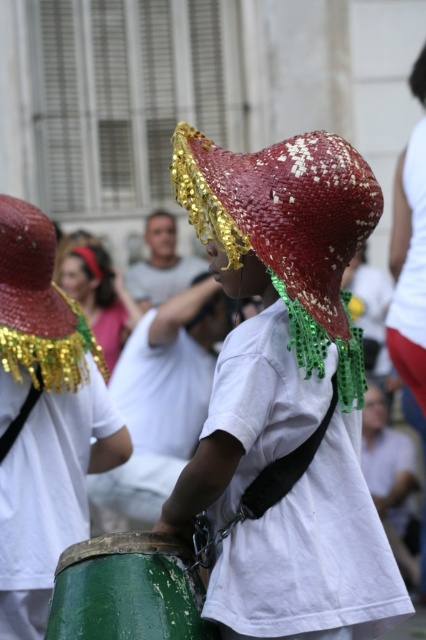
You are a photographer trying to capture the child in the center with their hat and drum. Since the red straw hat at center is taller than the green weathered wood drum at lower center, which object would you need to position closer to the camera to ensure both are fully visible in the frame?

To ensure both the red straw hat at center and the green weathered wood drum at lower center are fully visible in the frame, you should position the green weathered wood drum at lower center closer to the camera since it is shorter than the red straw hat at center.

You are a photographer standing at the center of the street. You want to take a photo that includes both the red woven hat at center and the red straw hat at center. Given that your camera has a maximum focus range of 4 feet, can you capture both objects in focus without moving your position?

The distance between the red woven hat at center and the red straw hat at center is 4.01 feet, which exceeds the camera maximum focus range of 4 feet. Therefore, you cannot capture both objects in focus without moving your position.